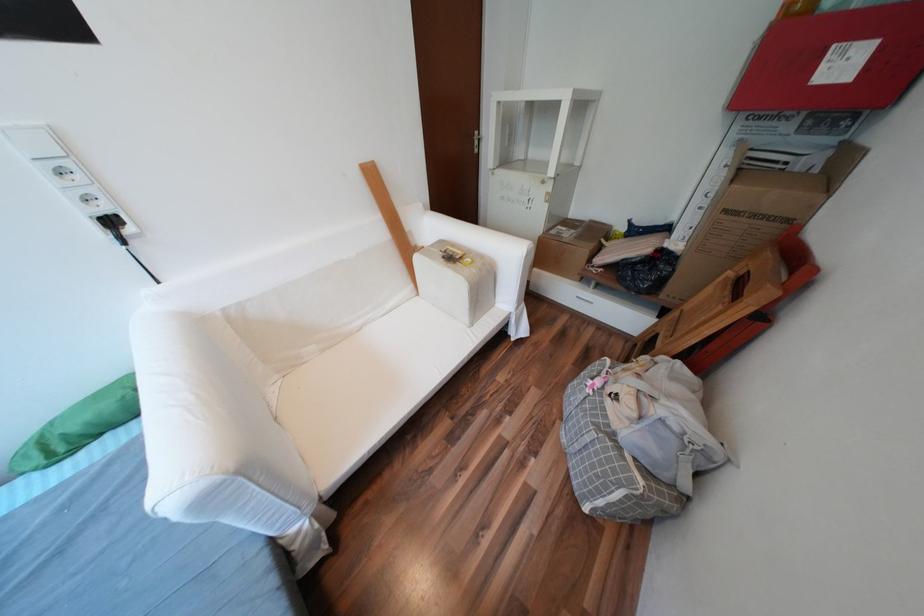
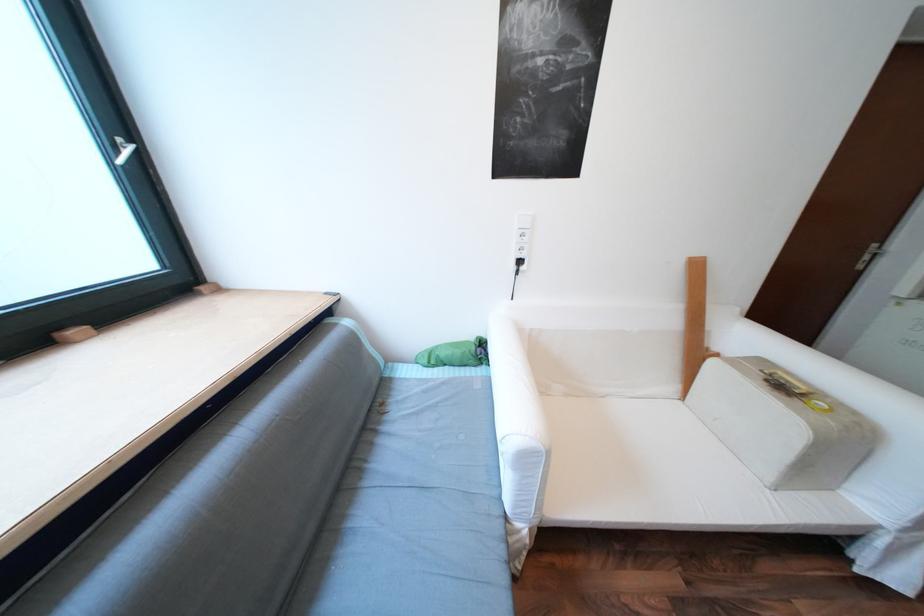
Where in the second image is the point corresponding to point (110, 435) from the first image?

(455, 365)